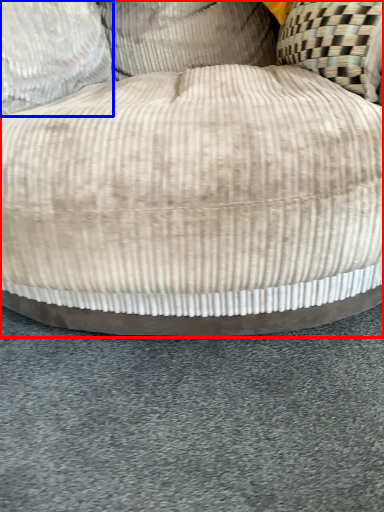
Question: Which object is further to the camera taking this photo, furniture (highlighted by a red box) or pillow (highlighted by a blue box)?

Choices:
 (A) furniture
 (B) pillow

Answer: (B)